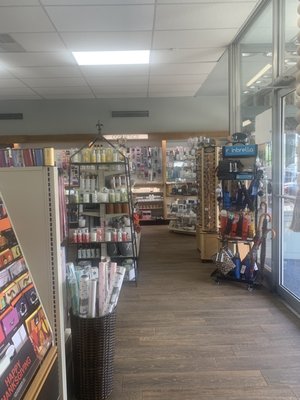
What are the coordinates of `lotion` in the screenshot? It's located at (98, 156).